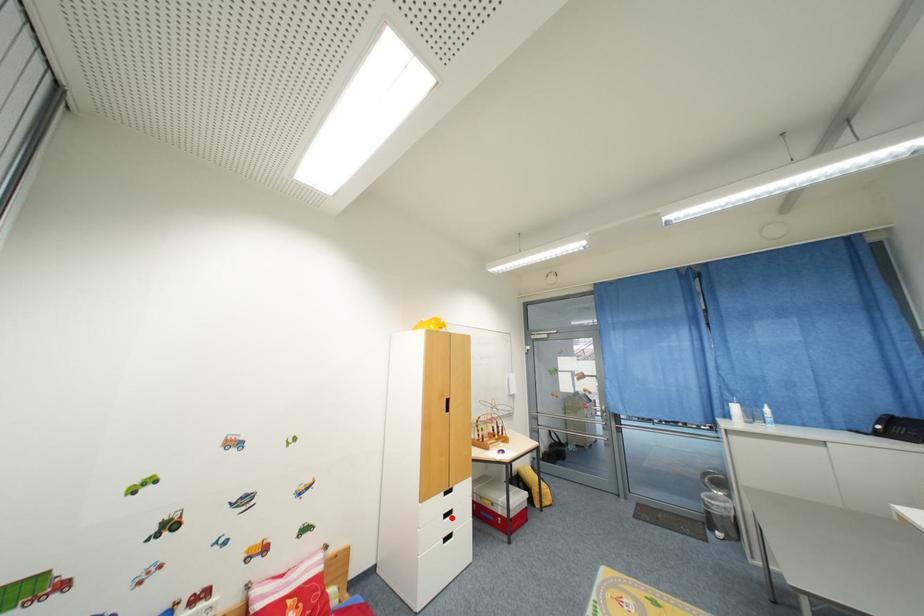
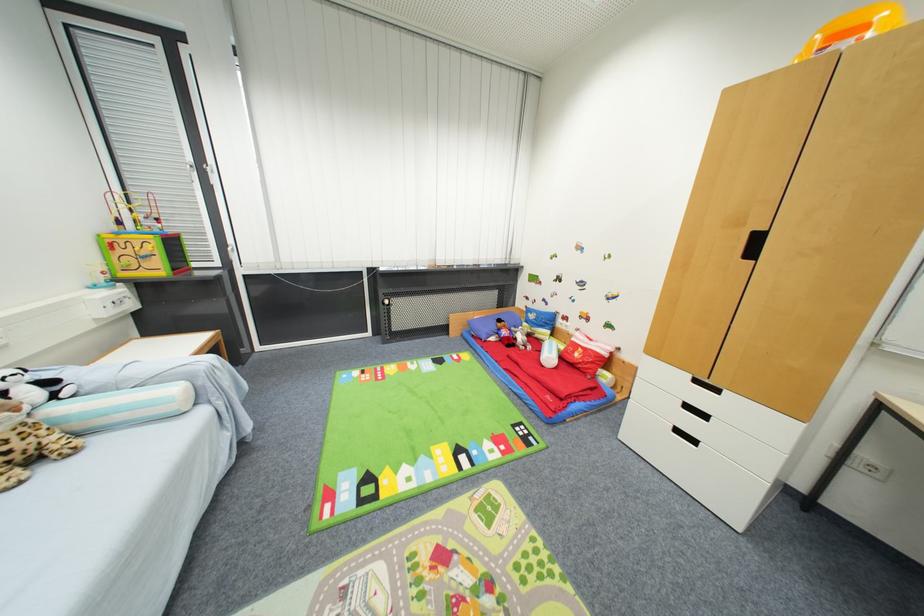
Question: I am providing you with two images of the same scene from different viewpoints. Image1 has a red point marked. In image2, the corresponding 3D location appears at what relative position? Reply with the corresponding letter.

Choices:
 (A) Closer
 (B) Farther

Answer: (A)